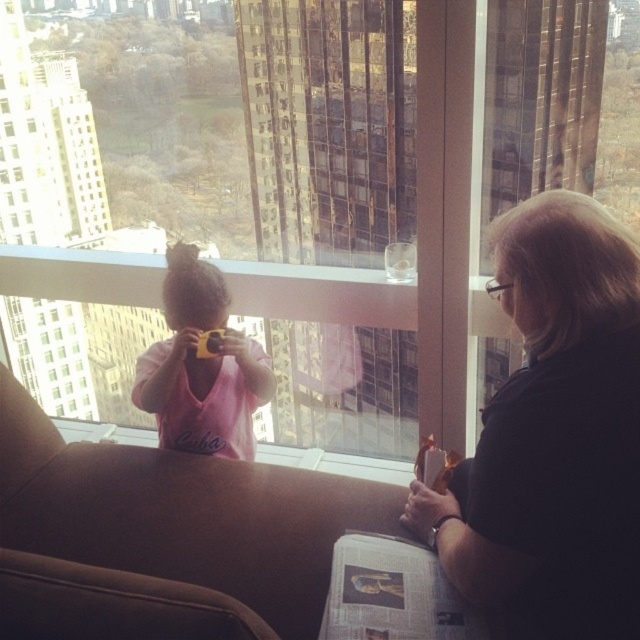
Is black matte shirt at right below pink matte shirt at center?

Correct, black matte shirt at right is located below pink matte shirt at center.

Which of these two, black matte shirt at right or pink matte shirt at center, stands shorter?

With less height is pink matte shirt at center.

Is point (604, 568) positioned behind point (225, 442)?

No, it is not.

You are a GUI agent. You are given a task and a screenshot of the screen. Output one action in this format:
    pyautogui.click(x=<x>, y=<y>)
    Task: Click on the black matte shirt at right
    
    Given the screenshot: What is the action you would take?
    pyautogui.click(x=554, y=436)

The height and width of the screenshot is (640, 640). Describe the element at coordinates (211, 125) in the screenshot. I see `transparent glass window at center` at that location.

Which is more to the left, transparent glass window at center or pink matte shirt at center?

Positioned to the left is pink matte shirt at center.

Which is in front, point (442, 106) or point (170, 284)?

Point (442, 106) is in front.

Find the location of a particular element. The height and width of the screenshot is (640, 640). transparent glass window at center is located at coordinates (211, 125).

Looking at this image, is the position of transparent glass window at center less distant than that of black matte shirt at right?

No, transparent glass window at center is behind black matte shirt at right.

Does point (477, 332) lie behind point (528, 627)?

Yes, point (477, 332) is behind point (528, 627).

What do you see at coordinates (211, 125) in the screenshot? The image size is (640, 640). I see `transparent glass window at center` at bounding box center [211, 125].

Where is `transparent glass window at center`? transparent glass window at center is located at coordinates (211, 125).